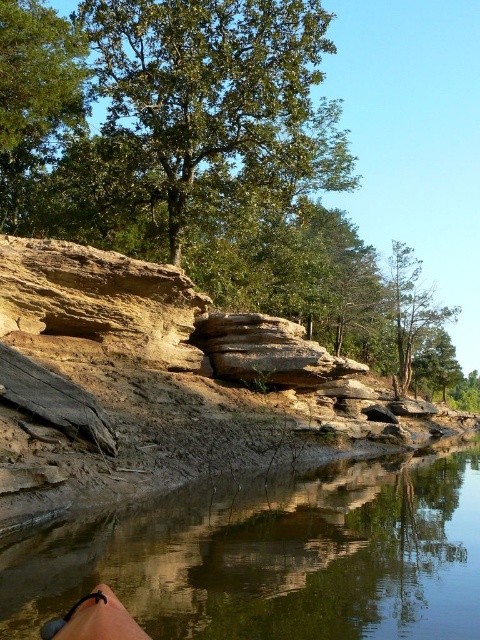
Is brown dirt river at lower center smaller than green leafy tree at upper center?

Correct, brown dirt river at lower center occupies less space than green leafy tree at upper center.

Between point (419, 483) and point (90, 13), which one is positioned behind?

Point (90, 13)

Measure the distance between point (406, 499) and camera.

They are 17.34 meters apart.

What are the coordinates of `brown dirt river at lower center` in the screenshot? It's located at (275, 556).

Is green leafy tree at upper center taller than green leafy tree at upper left?

Yes, green leafy tree at upper center is taller than green leafy tree at upper left.

Can you confirm if green leafy tree at upper center is positioned above green leafy tree at upper left?

Actually, green leafy tree at upper center is below green leafy tree at upper left.

Is point (109, 88) behind point (35, 54)?

That is True.

This screenshot has width=480, height=640. In order to click on green leafy tree at upper center in this screenshot , I will do `click(218, 100)`.

Is brown dirt river at lower center taller than green leafy tree at upper left?

Incorrect, brown dirt river at lower center's height is not larger of green leafy tree at upper left's.

Is point (282, 552) less distant than point (20, 112)?

Yes, it is in front of point (20, 112).

Does point (400, 570) lie in front of point (55, 17)?

Yes, it is in front of point (55, 17).

Locate an element on the screen. The image size is (480, 640). brown dirt river at lower center is located at coordinates (275, 556).